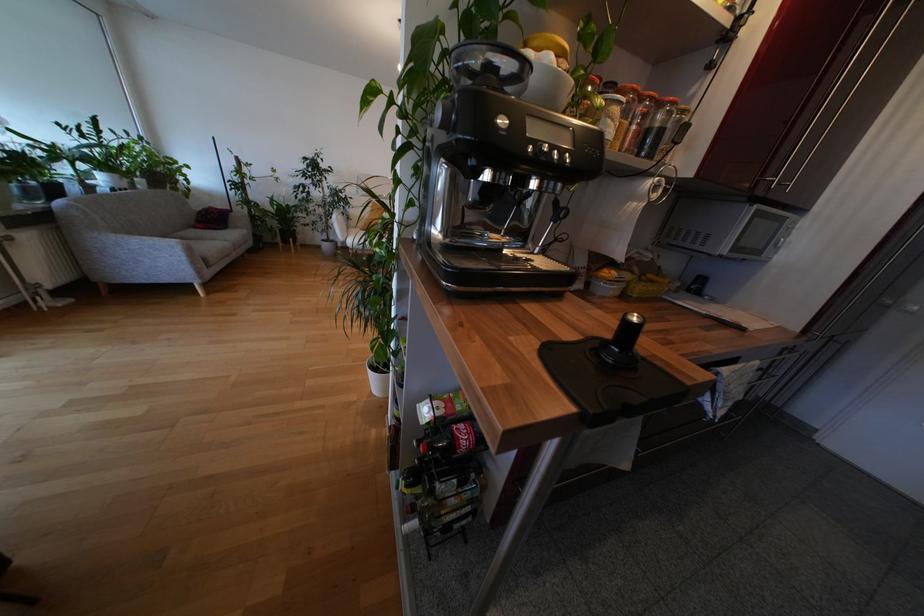
Where is `microwave door button`? microwave door button is located at coordinates (502, 121).